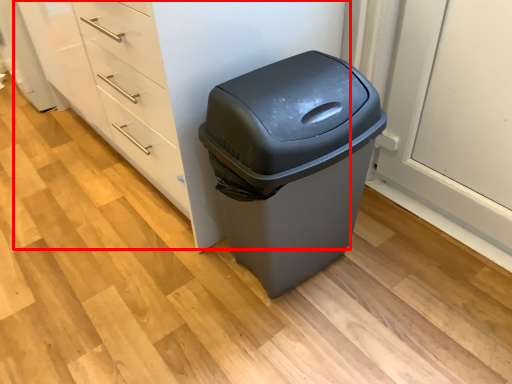
Question: Observing the image, what is the correct spatial positioning of dresser (annotated by the red box) in reference to waste container?

Choices:
 (A) left
 (B) right

Answer: (A)